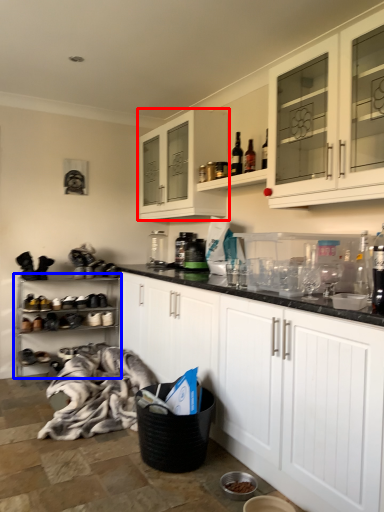
Question: Among these objects, which one is nearest to the camera, cabinetry (highlighted by a red box) or shelf (highlighted by a blue box)?

Choices:
 (A) cabinetry
 (B) shelf

Answer: (A)